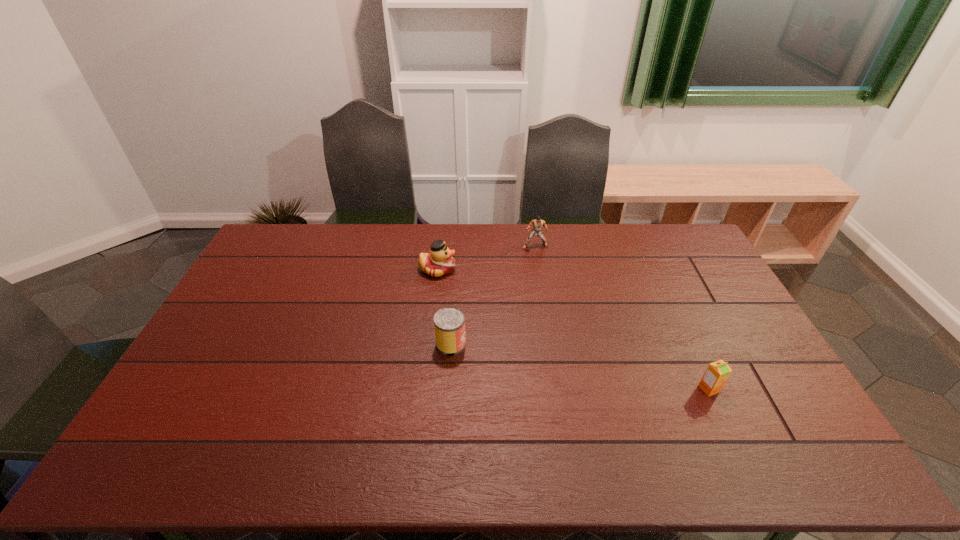
Identify the location of unoccupied area between the can and the third object from left to right. The height and width of the screenshot is (540, 960). (492, 295).

The height and width of the screenshot is (540, 960). In order to click on free space between the rightmost object and the duck in this screenshot , I will do `click(573, 329)`.

Find the location of `vacant area that lies between the third nearest object and the orange juice`. vacant area that lies between the third nearest object and the orange juice is located at coordinates (573, 329).

At what (x,y) coordinates should I click in order to perform the action: click on vacant area that lies between the third object from left to right and the duck. Please return your answer as a coordinate pair (x, y). The image size is (960, 540). Looking at the image, I should click on (486, 258).

Where is `free area in between the duck and the third object from left to right`? This screenshot has height=540, width=960. free area in between the duck and the third object from left to right is located at coordinates (486, 258).

Where is `free spot between the farthest object and the second farthest object`? This screenshot has width=960, height=540. free spot between the farthest object and the second farthest object is located at coordinates (486, 258).

You are a GUI agent. You are given a task and a screenshot of the screen. Output one action in this format:
    pyautogui.click(x=<x>, y=<y>)
    Task: Click on the blank region between the puncher and the orange juice
    The height and width of the screenshot is (540, 960).
    Given the screenshot: What is the action you would take?
    pyautogui.click(x=622, y=318)

The image size is (960, 540). I want to click on vacant space in between the puncher and the orange juice, so click(622, 318).

You are a GUI agent. You are given a task and a screenshot of the screen. Output one action in this format:
    pyautogui.click(x=<x>, y=<y>)
    Task: Click on the empty location between the nearest object and the puncher
    
    Given the screenshot: What is the action you would take?
    pyautogui.click(x=622, y=318)

Select which object appears as the third closest to the can. Please provide its 2D coordinates. Your answer should be formatted as a tuple, i.e. [(x, y)], where the tuple contains the x and y coordinates of a point satisfying the conditions above.

[(717, 373)]